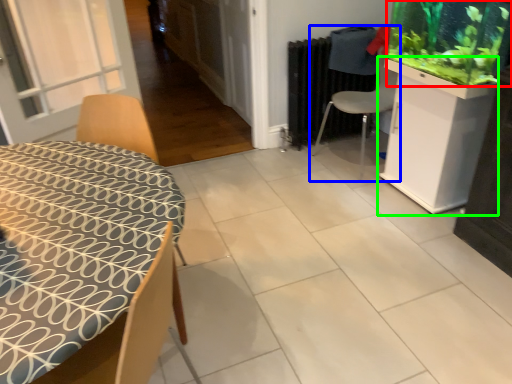
Question: Which object is the farthest from plant (highlighted by a red box)? Choose among these: chair (highlighted by a blue box) or cabinetry (highlighted by a green box).

Choices:
 (A) chair
 (B) cabinetry

Answer: (A)